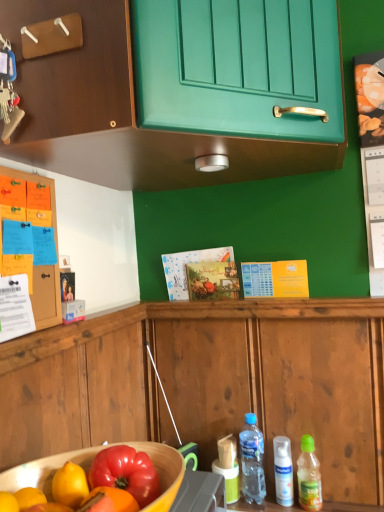
Question: Considering their positions, is wooden bowl at lower left located in front of or behind wooden cabinet at left, the 1th cabinetry in the bottom-to-top sequence?

Choices:
 (A) behind
 (B) front

Answer: (B)

Question: From a real-world perspective, is wooden bowl at lower left positioned above or below wooden cabinet at left, the 1th cabinetry in the bottom-to-top sequence?

Choices:
 (A) above
 (B) below

Answer: (B)

Question: Which of these objects is positioned closest to the green plastic bottle at lower right, placed as the 1th bottle when sorted from right to left?

Choices:
 (A) translucent plastic bottle at lower center, positioned as the first bottle in left-to-right order
 (B) wooden bowl at lower left
 (C) white matte spray can at lower right, the 2th bottle when ordered from right to left
 (D) wooden cabinet at left, the second cabinetry viewed from the top
 (E) green matte cabinet at upper center, the 2th cabinetry when ordered from bottom to top

Answer: (C)

Question: Which is nearer to the green plastic bottle at lower right, which is counted as the third bottle, starting from the left?

Choices:
 (A) wooden bowl at lower left
 (B) white matte spray can at lower right, the 2th bottle from the left
 (C) green matte cabinet at upper center, the 2th cabinetry when ordered from bottom to top
 (D) translucent plastic bottle at lower center, positioned as the first bottle in left-to-right order
 (E) wooden cabinet at left, the second cabinetry viewed from the top

Answer: (B)